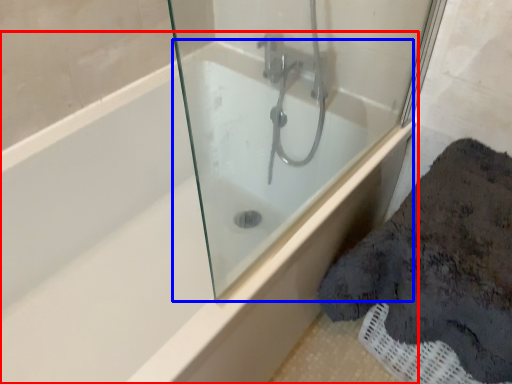
Question: Among these objects, which one is farthest to the camera, bathtub (highlighted by a red box) or bath (highlighted by a blue box)?

Choices:
 (A) bathtub
 (B) bath

Answer: (A)